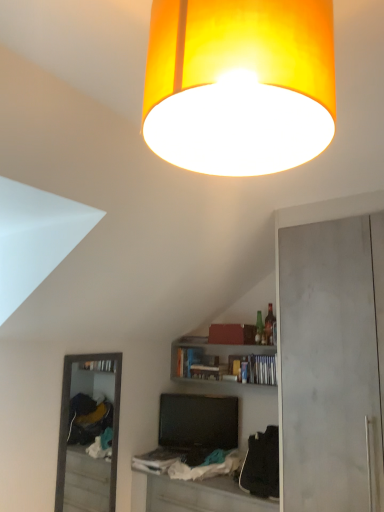
Question: Considering the relative sizes of black glossy television at center and orange fabric lampshade at upper center in the image provided, is black glossy television at center smaller than orange fabric lampshade at upper center?

Choices:
 (A) no
 (B) yes

Answer: (B)

Question: From the image's perspective, would you say black glossy television at center is shown under orange fabric lampshade at upper center?

Choices:
 (A) yes
 (B) no

Answer: (A)

Question: Is black glossy television at center further to camera compared to orange fabric lampshade at upper center?

Choices:
 (A) yes
 (B) no

Answer: (A)

Question: Does black glossy television at center appear on the left side of orange fabric lampshade at upper center?

Choices:
 (A) no
 (B) yes

Answer: (B)

Question: From a real-world perspective, is black glossy television at center under orange fabric lampshade at upper center?

Choices:
 (A) no
 (B) yes

Answer: (B)

Question: Is white fabric table at lower center inside the boundaries of black glossy television at center, or outside?

Choices:
 (A) inside
 (B) outside

Answer: (B)

Question: From a real-world perspective, relative to black glossy television at center, is white fabric table at lower center vertically above or below?

Choices:
 (A) above
 (B) below

Answer: (B)

Question: Is white fabric table at lower center to the left or to the right of black glossy television at center in the image?

Choices:
 (A) right
 (B) left

Answer: (A)

Question: Is white fabric table at lower center in front of or behind black glossy television at center in the image?

Choices:
 (A) behind
 (B) front

Answer: (B)

Question: Which is correct: orange fabric lampshade at upper center is inside wooden bookshelf at center, or outside of it?

Choices:
 (A) outside
 (B) inside

Answer: (A)

Question: Considering the positions of orange fabric lampshade at upper center and wooden bookshelf at center in the image, is orange fabric lampshade at upper center taller or shorter than wooden bookshelf at center?

Choices:
 (A) tall
 (B) short

Answer: (A)

Question: Would you say orange fabric lampshade at upper center is to the left or to the right of wooden bookshelf at center in the picture?

Choices:
 (A) right
 (B) left

Answer: (B)

Question: From the image's perspective, is orange fabric lampshade at upper center above or below wooden bookshelf at center?

Choices:
 (A) above
 (B) below

Answer: (A)

Question: Based on their sizes in the image, would you say black glossy television at center is bigger or smaller than wooden bookshelf at center?

Choices:
 (A) big
 (B) small

Answer: (B)

Question: From the image's perspective, relative to wooden bookshelf at center, is black glossy television at center above or below?

Choices:
 (A) above
 (B) below

Answer: (B)